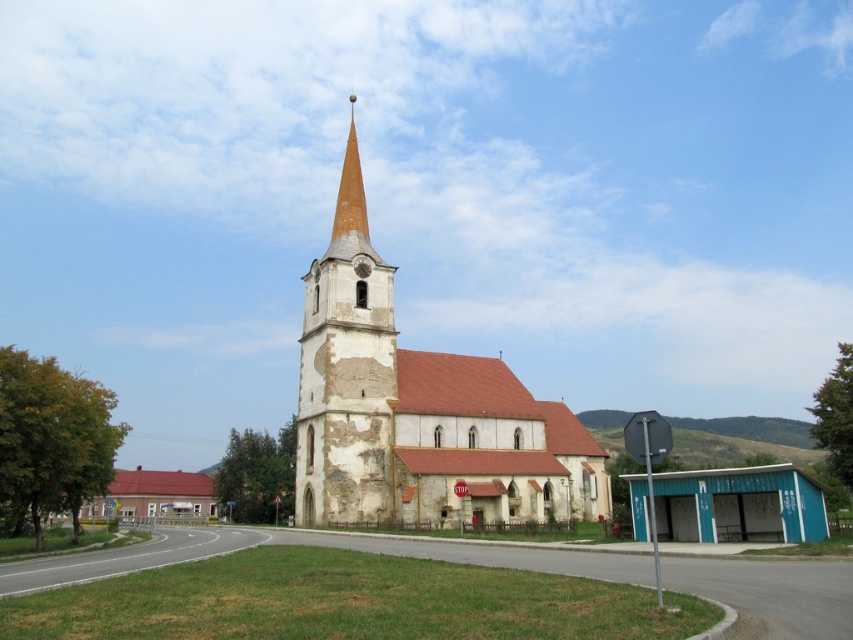
You are standing at the edge of the road near the grassy patch in front of the white stone church at center. You want to take a photo of the church with your smartphone. Your phone has a maximum zoom range of 5 meters. Will you be able to capture the entire church in the photo without moving closer?

The white stone church at center is 63.78 meters away from you. Since your phone can only zoom up to 5 meters, you won not be able to capture the entire church without moving closer.

You are standing at the edge of the grassy area in front of the church. You want to take a photo that includes both the white stone church at center and the yellowish stone steeple at center without any obstructions. Based on their distance apart, what is the minimum focal length lens you should use to capture both in the frame?

The white stone church at center and the yellowish stone steeple at center are 19.86 feet apart. To capture both in the frame without obstructions, you need a wide angle lens with a focal length of 35mm or lower, as this allows for a broader field of view to encompass the distance between them.

You are a photographer planning to capture the white stone church at center and the yellowish stone steeple at center in a single frame. Based on their widths, which object will appear wider in the photo?

The white stone church at center will appear wider in the photo since its width surpasses that of the yellowish stone steeple at center.